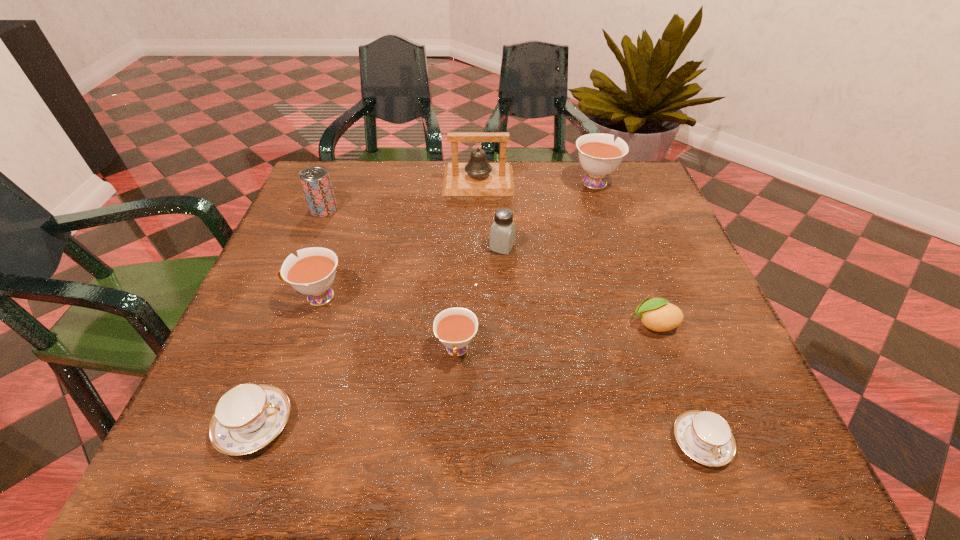
Find the location of a particular element. lemon is located at coordinates (657, 314).

Where is `the left blue teacup`? This screenshot has width=960, height=540. the left blue teacup is located at coordinates (247, 417).

At what (x,y) coordinates should I click in order to perform the action: click on the shortest object. Please return your answer as a coordinate pair (x, y). The width and height of the screenshot is (960, 540). Looking at the image, I should click on (704, 436).

Find the location of `the right blue teacup`. the right blue teacup is located at coordinates (704, 436).

This screenshot has width=960, height=540. In order to click on vacant space situated on the right of the tallest object in this screenshot , I will do `click(564, 181)`.

Where is `free space located on the back of the red beer can`? The width and height of the screenshot is (960, 540). free space located on the back of the red beer can is located at coordinates (344, 163).

You are a GUI agent. You are given a task and a screenshot of the screen. Output one action in this format:
    pyautogui.click(x=<x>, y=<y>)
    Task: Click on the blank area located on the right of the saltshaker
    The height and width of the screenshot is (540, 960).
    Given the screenshot: What is the action you would take?
    pyautogui.click(x=541, y=247)

Locate an element on the screen. This screenshot has height=540, width=960. free space located 0.120m on the side of the second white teacup from right to left with the handle is located at coordinates (453, 436).

Where is `free space located 0.260m with leaves positioned above the yellow lemon`? free space located 0.260m with leaves positioned above the yellow lemon is located at coordinates (494, 324).

Identify the location of free space located 0.250m with leaves positioned above the yellow lemon. (499, 324).